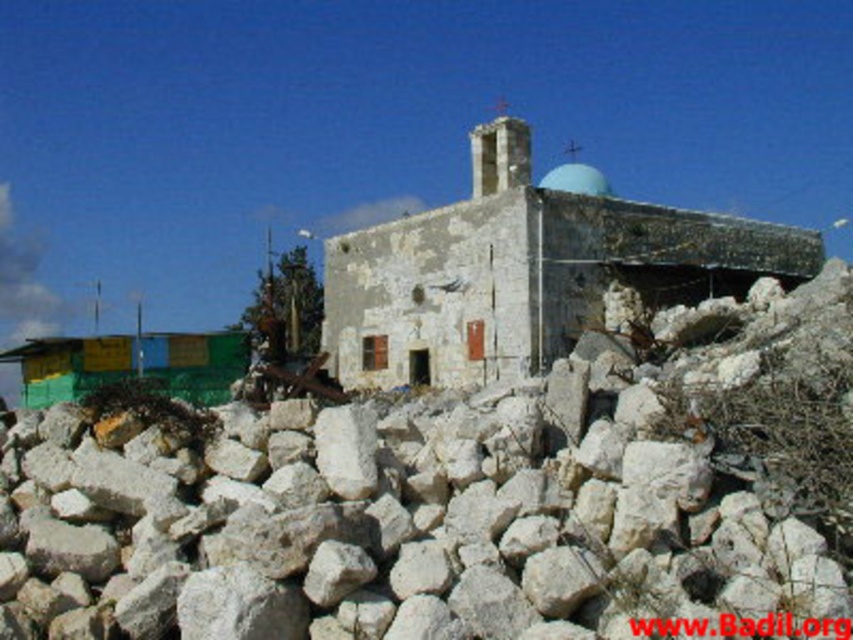
Question: Which of the following is the closest to the observer?

Choices:
 (A) (32, 436)
 (B) (543, 296)

Answer: (A)

Question: Considering the relative positions of white rough rubble at center and white stone church at center in the image provided, where is white rough rubble at center located with respect to white stone church at center?

Choices:
 (A) left
 (B) right

Answer: (A)

Question: Where is white rough rubble at center located in relation to white stone church at center in the image?

Choices:
 (A) above
 (B) below

Answer: (B)

Question: Can you confirm if white rough rubble at center is positioned to the left of white stone church at center?

Choices:
 (A) yes
 (B) no

Answer: (A)